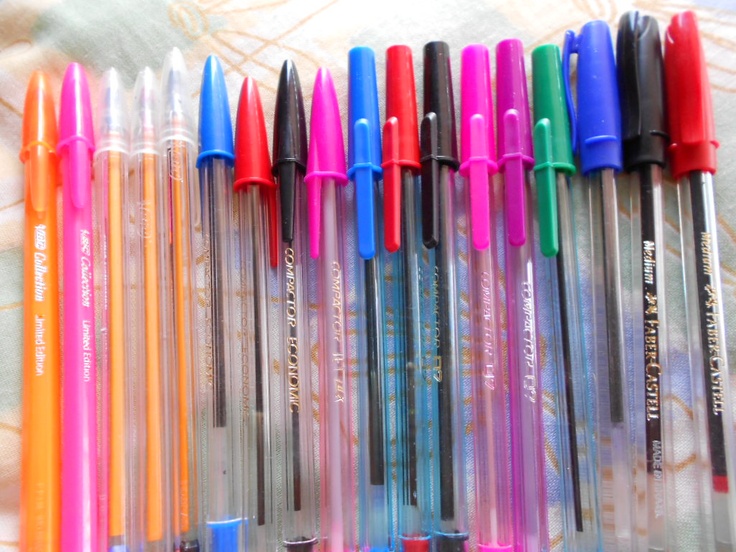
This screenshot has height=552, width=736. I want to click on pens with pink or red ink, so click(x=79, y=294), click(x=255, y=261), click(x=332, y=270), click(x=408, y=273), click(x=481, y=282), click(x=517, y=278), click(x=706, y=260).